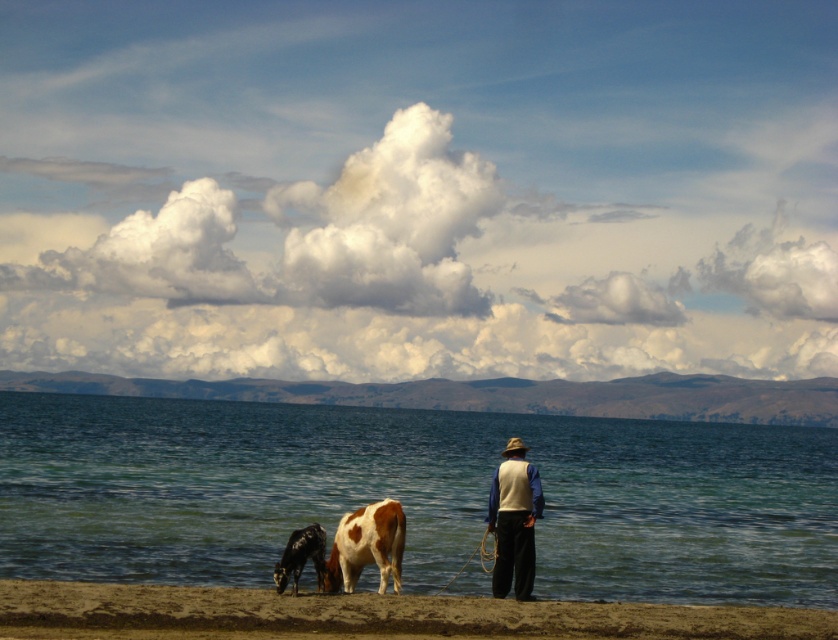
Question: Can you confirm if light beige vest at center is positioned below brown speckled hide at lower center?

Choices:
 (A) yes
 (B) no

Answer: (B)

Question: Which object is closer to the camera taking this photo?

Choices:
 (A) brown sand at lower center
 (B) light beige vest at center

Answer: (A)

Question: Which point is farther to the camera?

Choices:
 (A) black glossy cow at lower left
 (B) clear blue water at lower center

Answer: (B)

Question: Is clear blue water at lower center to the left of brown speckled hide at lower center from the viewer's perspective?

Choices:
 (A) yes
 (B) no

Answer: (A)

Question: Which of these objects is positioned closest to the brown speckled hide at lower center?

Choices:
 (A) black glossy cow at lower left
 (B) brown sand at lower center
 (C) clear blue water at lower center
 (D) light beige vest at center

Answer: (A)

Question: Does brown sand at lower center have a smaller size compared to light beige vest at center?

Choices:
 (A) no
 (B) yes

Answer: (A)